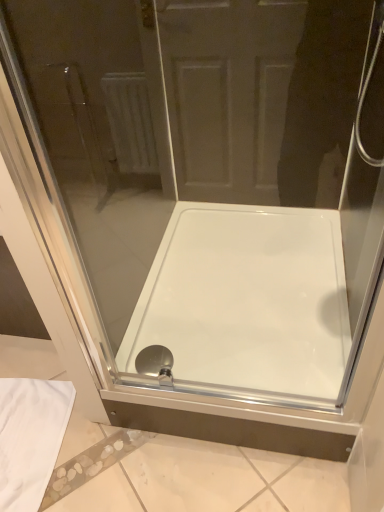
What do you see at coordinates (156, 362) in the screenshot?
I see `matte silver showerhead at bottom center` at bounding box center [156, 362].

At what (x,y) coordinates should I click in order to perform the action: click on matte silver showerhead at bottom center. Please return your answer as a coordinate pair (x, y). Image resolution: width=384 pixels, height=512 pixels. Looking at the image, I should click on [x=156, y=362].

From the picture: What is the approximate height of matte silver showerhead at bottom center?

matte silver showerhead at bottom center is 4.02 centimeters in height.

Locate an element on the screen. The image size is (384, 512). white glossy bathtub at center is located at coordinates (247, 300).

What do you see at coordinates (247, 300) in the screenshot? The width and height of the screenshot is (384, 512). I see `white glossy bathtub at center` at bounding box center [247, 300].

This screenshot has width=384, height=512. I want to click on matte silver showerhead at bottom center, so click(x=156, y=362).

Between matte silver showerhead at bottom center and white glossy bathtub at center, which one appears on the right side from the viewer's perspective?

From the viewer's perspective, white glossy bathtub at center appears more on the right side.

In the image, is matte silver showerhead at bottom center positioned in front of or behind white glossy bathtub at center?

matte silver showerhead at bottom center is behind white glossy bathtub at center.

Considering the positions of points (141, 354) and (255, 233), is point (141, 354) farther from camera compared to point (255, 233)?

That is False.

From the image's perspective, who appears lower, matte silver showerhead at bottom center or white glossy bathtub at center?

matte silver showerhead at bottom center is shown below in the image.

From a real-world perspective, who is located lower, matte silver showerhead at bottom center or white glossy bathtub at center?

In real-world perspective, white glossy bathtub at center is lower.

Which of these two, matte silver showerhead at bottom center or white glossy bathtub at center, is wider?

Wider between the two is white glossy bathtub at center.

Considering the sizes of objects matte silver showerhead at bottom center and white glossy bathtub at center in the image provided, who is shorter, matte silver showerhead at bottom center or white glossy bathtub at center?

With less height is matte silver showerhead at bottom center.

Based on their sizes in the image, would you say matte silver showerhead at bottom center is bigger or smaller than white glossy bathtub at center?

In the image, matte silver showerhead at bottom center appears to be smaller than white glossy bathtub at center.

Is matte silver showerhead at bottom center not within white glossy bathtub at center?

No.

Would you consider matte silver showerhead at bottom center to be distant from white glossy bathtub at center?

matte silver showerhead at bottom center is near white glossy bathtub at center, not far away.

Is matte silver showerhead at bottom center oriented towards white glossy bathtub at center?

Yes, matte silver showerhead at bottom center is oriented towards white glossy bathtub at center.

Measure the distance from matte silver showerhead at bottom center to white glossy bathtub at center.

16.04 inches.

At what (x,y) coordinates should I click in order to perform the action: click on bathtub below the matte silver showerhead at bottom center (from a real-world perspective). Please return your answer as a coordinate pair (x, y). The width and height of the screenshot is (384, 512). Looking at the image, I should click on (247, 300).

Considering the relative positions of white glossy bathtub at center and matte silver showerhead at bottom center in the image provided, is white glossy bathtub at center to the left or to the right of matte silver showerhead at bottom center?

white glossy bathtub at center is to the right of matte silver showerhead at bottom center.

Considering the positions of objects white glossy bathtub at center and matte silver showerhead at bottom center in the image provided, who is in front, white glossy bathtub at center or matte silver showerhead at bottom center?

white glossy bathtub at center is closer to the camera.

Between point (196, 219) and point (151, 355), which one is positioned behind?

The point (196, 219) is farther.

Based on the photo, from the image's perspective, which object appears higher, white glossy bathtub at center or matte silver showerhead at bottom center?

white glossy bathtub at center.

From a real-world perspective, is white glossy bathtub at center located higher than matte silver showerhead at bottom center?

Incorrect, from a real-world perspective, white glossy bathtub at center is lower than matte silver showerhead at bottom center.

Which object is thinner, white glossy bathtub at center or matte silver showerhead at bottom center?

With smaller width is matte silver showerhead at bottom center.

Is white glossy bathtub at center taller than matte silver showerhead at bottom center?

Yes, white glossy bathtub at center is taller than matte silver showerhead at bottom center.

Based on their sizes in the image, would you say white glossy bathtub at center is bigger or smaller than matte silver showerhead at bottom center?

white glossy bathtub at center is bigger than matte silver showerhead at bottom center.

Can we say white glossy bathtub at center lies outside matte silver showerhead at bottom center?

Absolutely, white glossy bathtub at center is external to matte silver showerhead at bottom center.

Would you say white glossy bathtub at center is a long distance from matte silver showerhead at bottom center?

white glossy bathtub at center is actually quite close to matte silver showerhead at bottom center.

Could you tell me if white glossy bathtub at center is turned towards matte silver showerhead at bottom center?

Yes, white glossy bathtub at center is aimed at matte silver showerhead at bottom center.

Can you tell me how much white glossy bathtub at center and matte silver showerhead at bottom center differ in facing direction?

The facing directions of white glossy bathtub at center and matte silver showerhead at bottom center are 0.000512 degrees apart.

The image size is (384, 512). What are the coordinates of `bathtub located on the right of matte silver showerhead at bottom center` in the screenshot? It's located at (247, 300).

Identify the location of shower below the white glossy bathtub at center (from the image's perspective). [x=156, y=362].

The height and width of the screenshot is (512, 384). Identify the location of bathtub to the right of matte silver showerhead at bottom center. (247, 300).